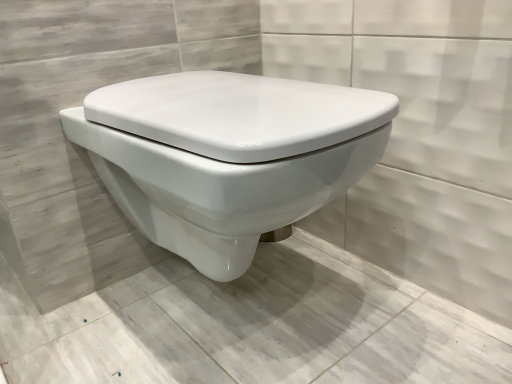
Question: In the image, is white glossy toilet at center on the left side or the right side of white glossy toilet at center?

Choices:
 (A) right
 (B) left

Answer: (A)

Question: Is white glossy toilet at center wider or thinner than white glossy toilet at center?

Choices:
 (A) wide
 (B) thin

Answer: (B)

Question: From their relative heights in the image, would you say white glossy toilet at center is taller or shorter than white glossy toilet at center?

Choices:
 (A) tall
 (B) short

Answer: (A)

Question: From the image's perspective, is white glossy toilet at center above or below white glossy toilet at center?

Choices:
 (A) above
 (B) below

Answer: (B)

Question: In the image, is white glossy toilet at center positioned in front of or behind white glossy toilet at center?

Choices:
 (A) behind
 (B) front

Answer: (B)

Question: Is white glossy toilet at center inside or outside of white glossy toilet at center?

Choices:
 (A) outside
 (B) inside

Answer: (A)

Question: Visually, is white glossy toilet at center positioned to the left or to the right of white glossy toilet at center?

Choices:
 (A) left
 (B) right

Answer: (A)